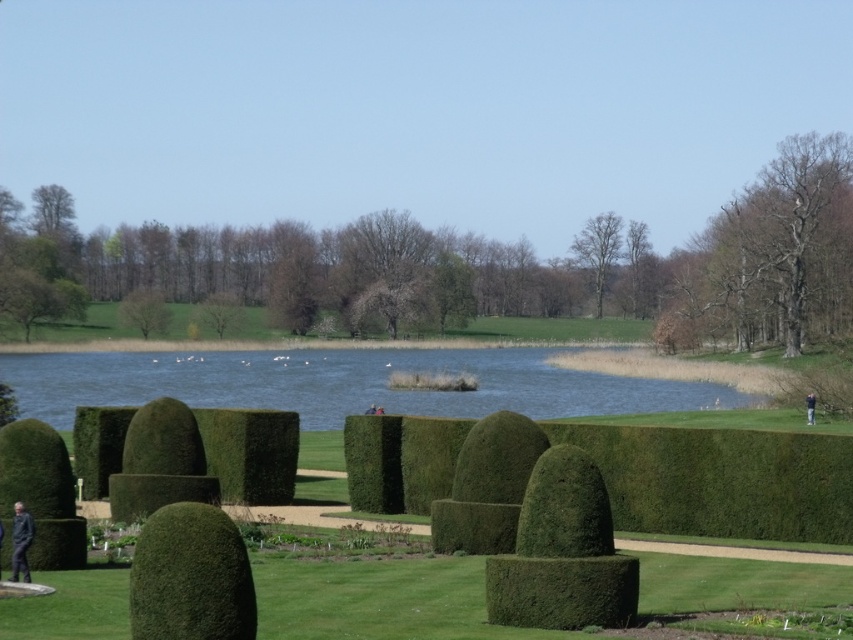
You are standing in the garden and want to know how far the point at coordinates (495, 372) is from you. Can you determine the distance?

The point at coordinates (495, 372) is 126.51 meters away from the viewer.

You are standing in the garden and want to reach the blue water at center. According to the coordinates provided, in which direction should you walk from your current position to reach it?

The blue water at center is located at coordinates point (x=341, y=384). Since the coordinate system is not specified, but assuming standard image coordinates where x increases to the right and y increases downward, you should walk towards the center of the image where the blue water is located.

You are standing at the center of the garden and want to find the green leafy hedge at lower left. According to the coordinates provided, where should you look relative to your position?

The green leafy hedge at lower left is located at point coordinates lower left, so you should look towards the lower left direction from your current position at the garden center.